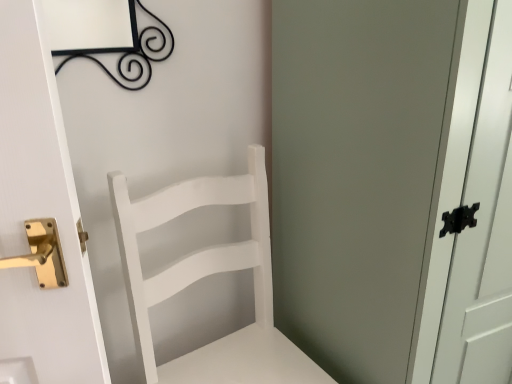
The height and width of the screenshot is (384, 512). I want to click on white matte chair at center, so click(208, 275).

Describe the element at coordinates (208, 275) in the screenshot. I see `white matte chair at center` at that location.

Image resolution: width=512 pixels, height=384 pixels. Describe the element at coordinates (355, 174) in the screenshot. I see `white matte cabinet at right` at that location.

Identify the location of white matte cabinet at right. This screenshot has width=512, height=384. (355, 174).

Where is `white matte chair at center`? Image resolution: width=512 pixels, height=384 pixels. white matte chair at center is located at coordinates (208, 275).

Which object is positioned more to the left, white matte cabinet at right or white matte chair at center?

From the viewer's perspective, white matte chair at center appears more on the left side.

Who is more distant, white matte cabinet at right or white matte chair at center?

white matte chair at center is more distant.

Between point (328, 300) and point (252, 240), which one is positioned behind?

The point (252, 240) is more distant.

From the image's perspective, is white matte cabinet at right located above white matte chair at center?

Yes, from the image's perspective, white matte cabinet at right is over white matte chair at center.

From a real-world perspective, is white matte cabinet at right positioned above or below white matte chair at center?

In terms of real-world spatial position, white matte cabinet at right is above white matte chair at center.

Considering the sizes of objects white matte cabinet at right and white matte chair at center in the image provided, who is wider, white matte cabinet at right or white matte chair at center?

white matte cabinet at right.

Between white matte cabinet at right and white matte chair at center, which one has less height?

With less height is white matte chair at center.

Considering the relative sizes of white matte cabinet at right and white matte chair at center in the image provided, is white matte cabinet at right bigger than white matte chair at center?

Yes.

Is white matte cabinet at right positioned beyond the bounds of white matte chair at center?

Indeed, white matte cabinet at right is completely outside white matte chair at center.

Are white matte cabinet at right and white matte chair at center making contact?

No.

Is white matte cabinet at right oriented away from white matte chair at center?

No.

From the picture: How much distance is there between white matte cabinet at right and white matte chair at center?

white matte cabinet at right and white matte chair at center are 10.11 inches apart.

Identify the location of furniture behind the white matte cabinet at right. This screenshot has width=512, height=384. (208, 275).

Is white matte chair at center to the right of white matte cabinet at right from the viewer's perspective?

Incorrect, white matte chair at center is not on the right side of white matte cabinet at right.

Is white matte chair at center closer to the viewer compared to white matte cabinet at right?

No.

Considering the positions of point (168, 218) and point (410, 280), is point (168, 218) closer or farther from the camera than point (410, 280)?

Point (168, 218) appears to be farther away from the viewer than point (410, 280).

From the image's perspective, is white matte chair at center located above or below white matte cabinet at right?

Clearly, from the image's perspective, white matte chair at center is below white matte cabinet at right.

From a real-world perspective, who is located higher, white matte chair at center or white matte cabinet at right?

From a 3D spatial view, white matte cabinet at right is above.

Is white matte chair at center wider than white matte cabinet at right?

Incorrect, the width of white matte chair at center does not surpass that of white matte cabinet at right.

Does white matte chair at center have a greater height compared to white matte cabinet at right?

No, white matte chair at center is not taller than white matte cabinet at right.

Between white matte chair at center and white matte cabinet at right, which one has larger size?

With larger size is white matte cabinet at right.

Is white matte cabinet at right surrounded by white matte chair at center?

No, white matte cabinet at right is located outside of white matte chair at center.

Does white matte chair at center touch white matte cabinet at right?

white matte chair at center and white matte cabinet at right are not in contact.

Could you tell me if white matte chair at center is turned towards white matte cabinet at right?

No, white matte chair at center does not turn towards white matte cabinet at right.

Consider the image. How far apart are white matte chair at center and white matte cabinet at right?

10.11 inches.

Locate an element on the screen. The image size is (512, 384). furniture that appears behind the white matte cabinet at right is located at coordinates (208, 275).

Identify the location of furniture below the white matte cabinet at right (from the image's perspective). (208, 275).

Find the location of `furniture to the left of white matte cabinet at right`. furniture to the left of white matte cabinet at right is located at coordinates (208, 275).